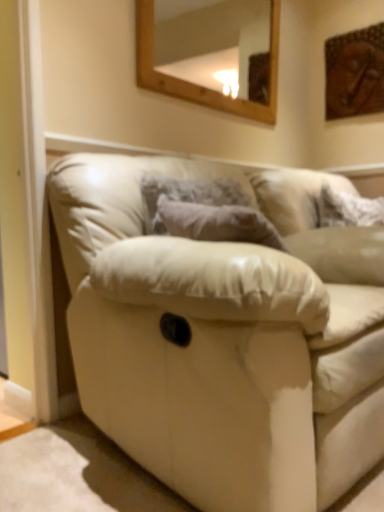
The height and width of the screenshot is (512, 384). Find the location of `white fluffy pillow at upper right`. white fluffy pillow at upper right is located at coordinates (349, 209).

Measure the distance between wooden carving at upper right and camera.

8.31 feet.

Measure the distance between leather couch at center and camera.

The depth of leather couch at center is 30.95 inches.

This screenshot has height=512, width=384. In order to click on white fluffy pillow at upper right in this screenshot , I will do `click(349, 209)`.

Which is more to the left, leather couch at center or wooden-framed mirror at upper center?

wooden-framed mirror at upper center is more to the left.

Considering the relative sizes of leather couch at center and wooden-framed mirror at upper center in the image provided, is leather couch at center wider than wooden-framed mirror at upper center?

Correct, the width of leather couch at center exceeds that of wooden-framed mirror at upper center.

Is wooden-framed mirror at upper center surrounded by leather couch at center?

That's incorrect, wooden-framed mirror at upper center is not inside leather couch at center.

How far apart are wooden carving at upper right and leather couch at center?

The distance of wooden carving at upper right from leather couch at center is 6.28 feet.

Considering the positions of objects wooden carving at upper right and leather couch at center in the image provided, who is more to the left, wooden carving at upper right or leather couch at center?

leather couch at center is more to the left.

From the image's perspective, which is below, wooden carving at upper right or leather couch at center?

leather couch at center appears lower in the image.

Considering the relative sizes of wooden carving at upper right and leather couch at center in the image provided, is wooden carving at upper right taller than leather couch at center?

Incorrect, the height of wooden carving at upper right is not larger of that of leather couch at center.

Can you confirm if white fluffy pillow at upper right is smaller than wooden carving at upper right?

No, white fluffy pillow at upper right is not smaller than wooden carving at upper right.

Which point is more distant from viewer, [334,207] or [362,58]?

The point [362,58] is more distant.

From the image's perspective, is white fluffy pillow at upper right located above or below wooden carving at upper right?

Clearly, from the image's perspective, white fluffy pillow at upper right is below wooden carving at upper right.

Consider the image. Is white fluffy pillow at upper right at the right side of wooden carving at upper right?

No.

Considering the relative positions of wooden carving at upper right and white fluffy pillow at upper right in the image provided, is wooden carving at upper right to the left or to the right of white fluffy pillow at upper right?

wooden carving at upper right is to the right of white fluffy pillow at upper right.

From the image's perspective, who appears lower, wooden carving at upper right or white fluffy pillow at upper right?

white fluffy pillow at upper right is shown below in the image.

How far apart are wooden carving at upper right and white fluffy pillow at upper right?

35.03 inches.

Is point (333, 37) farther from camera compared to point (334, 207)?

Yes, it is behind point (334, 207).

In the scene shown: From the image's perspective, would you say leather couch at center is shown under white fluffy pillow at upper right?

Yes, from the image's perspective, leather couch at center is below white fluffy pillow at upper right.

How different are the orientations of leather couch at center and white fluffy pillow at upper right in degrees?

There is a 10.6-degree angle between the facing directions of leather couch at center and white fluffy pillow at upper right.

Locate an element on the screen. The width and height of the screenshot is (384, 512). studio couch below the white fluffy pillow at upper right (from a real-world perspective) is located at coordinates (223, 340).

Considering the relative positions of leather couch at center and white fluffy pillow at upper right in the image provided, is leather couch at center behind white fluffy pillow at upper right?

No, leather couch at center is closer to the viewer.

In the image, there is a wooden carving at upper right. Where is `studio couch below it (from a real-world perspective)`? This screenshot has width=384, height=512. studio couch below it (from a real-world perspective) is located at coordinates (223, 340).

Which object is positioned more to the right, leather couch at center or wooden carving at upper right?

From the viewer's perspective, wooden carving at upper right appears more on the right side.

Is point (153, 431) closer to viewer compared to point (325, 41)?

Yes, point (153, 431) is closer to viewer.

Considering the relative sizes of white fluffy pillow at upper right and leather couch at center in the image provided, is white fluffy pillow at upper right bigger than leather couch at center?

No.

Would you say white fluffy pillow at upper right is a long distance from leather couch at center?

Indeed, white fluffy pillow at upper right is not near leather couch at center.

In the image, there is a white fluffy pillow at upper right. At what (x,y) coordinates should I click in order to perform the action: click on studio couch below it (from the image's perspective). Please return your answer as a coordinate pair (x, y). This screenshot has width=384, height=512. Looking at the image, I should click on (223, 340).

What are the coordinates of `studio couch in front of the wooden-framed mirror at upper center` in the screenshot? It's located at (223, 340).

Locate an element on the screen. Image resolution: width=384 pixels, height=512 pixels. studio couch to the left of wooden carving at upper right is located at coordinates (223, 340).

Which object lies nearer to the anchor point white fluffy pillow at upper right, wooden carving at upper right or wooden-framed mirror at upper center?

wooden carving at upper right is closer to white fluffy pillow at upper right.

Looking at the image, which one is located further to wooden-framed mirror at upper center, white fluffy pillow at upper right or leather couch at center?

leather couch at center.

Estimate the real-world distances between objects in this image. Which object is further from wooden carving at upper right, leather couch at center or wooden-framed mirror at upper center?

Based on the image, leather couch at center appears to be further to wooden carving at upper right.

From the image, which object appears to be farther from leather couch at center, wooden carving at upper right or white fluffy pillow at upper right?

Among the two, wooden carving at upper right is located further to leather couch at center.

Consider the image. Which object lies further to the anchor point wooden-framed mirror at upper center, leather couch at center or white fluffy pillow at upper right?

leather couch at center.

Which object lies nearer to the anchor point wooden-framed mirror at upper center, wooden carving at upper right or white fluffy pillow at upper right?

wooden carving at upper right is positioned closer to the anchor wooden-framed mirror at upper center.

Looking at the image, which one is located closer to wooden-framed mirror at upper center, white fluffy pillow at upper right or wooden carving at upper right?

wooden carving at upper right.

Which object lies further to the anchor point white fluffy pillow at upper right, wooden carving at upper right or leather couch at center?

Among the two, leather couch at center is located further to white fluffy pillow at upper right.

You are a GUI agent. You are given a task and a screenshot of the screen. Output one action in this format:
    pyautogui.click(x=<x>, y=<y>)
    Task: Click on the mirror between leather couch at center and wooden carving at upper right in the front-back direction
    Image resolution: width=384 pixels, height=512 pixels.
    Given the screenshot: What is the action you would take?
    pyautogui.click(x=211, y=40)

What are the coordinates of `mirror between wooden carving at upper right and white fluffy pillow at upper right in the vertical direction` in the screenshot? It's located at (211, 40).

Image resolution: width=384 pixels, height=512 pixels. In order to click on pillow between leather couch at center and wooden carving at upper right along the z-axis in this screenshot , I will do `click(349, 209)`.

Locate an element on the screen. This screenshot has height=512, width=384. mirror located between leather couch at center and white fluffy pillow at upper right in the depth direction is located at coordinates (211, 40).